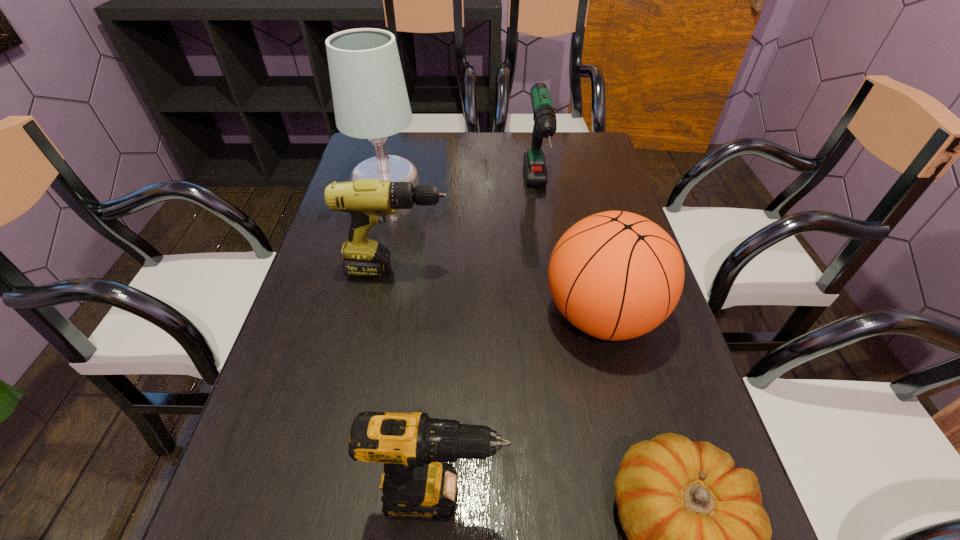
This screenshot has width=960, height=540. Find the location of `lampshade positioned at the far edge`. lampshade positioned at the far edge is located at coordinates tap(370, 99).

Locate an element on the screen. Image resolution: width=960 pixels, height=540 pixels. drill situated at the far edge is located at coordinates (545, 124).

You are a GUI agent. You are given a task and a screenshot of the screen. Output one action in this format:
    pyautogui.click(x=<x>, y=<y>)
    Task: Click on the lampshade that is at the left edge
    
    Given the screenshot: What is the action you would take?
    pyautogui.click(x=370, y=99)

You are a GUI agent. You are given a task and a screenshot of the screen. Output one action in this format:
    pyautogui.click(x=<x>, y=<y>)
    Task: Click on the drill that is at the left edge
    
    Given the screenshot: What is the action you would take?
    pyautogui.click(x=368, y=201)

I want to click on object situated at the right edge, so click(x=615, y=275).

Locate an element on the screen. Image resolution: width=960 pixels, height=540 pixels. object located in the far left corner section of the desktop is located at coordinates (370, 99).

The height and width of the screenshot is (540, 960). In the image, there is a desktop. What are the coordinates of `free space at the far edge` in the screenshot? It's located at (501, 144).

You are a GUI agent. You are given a task and a screenshot of the screen. Output one action in this format:
    pyautogui.click(x=<x>, y=<y>)
    Task: Click on the vacant space at the left edge of the desktop
    Image resolution: width=960 pixels, height=540 pixels.
    Given the screenshot: What is the action you would take?
    click(x=312, y=501)

Image resolution: width=960 pixels, height=540 pixels. In order to click on vacant region at the right edge of the desktop in this screenshot , I will do `click(563, 173)`.

Find the location of `vacant space at the far right corner`. vacant space at the far right corner is located at coordinates pos(597,166).